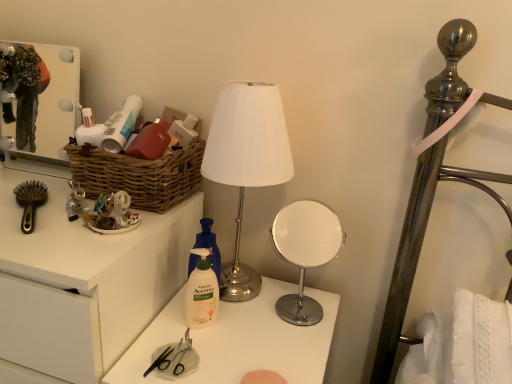
Question: In terms of size, does white glossy drawer at left appear bigger or smaller than brown plastic brush at left?

Choices:
 (A) small
 (B) big

Answer: (B)

Question: Considering their positions, is white glossy drawer at left located in front of or behind brown plastic brush at left?

Choices:
 (A) front
 (B) behind

Answer: (A)

Question: Which object is positioned farthest from the white glossy mirror at center right?

Choices:
 (A) white glossy drawer at left
 (B) white glossy medicine cabinet at upper left
 (C) brown plastic brush at left
 (D) brown woven basket at left
 (E) white matte lamp at center

Answer: (C)

Question: Which of these objects is positioned farthest from the metallic silver scissors at center?

Choices:
 (A) brown woven basket at left
 (B) white glossy medicine cabinet at upper left
 (C) matte plastic scissors at center
 (D) matte white tube at upper left, the second toiletry when ordered from bottom to top
 (E) white glossy drawer at left

Answer: (B)